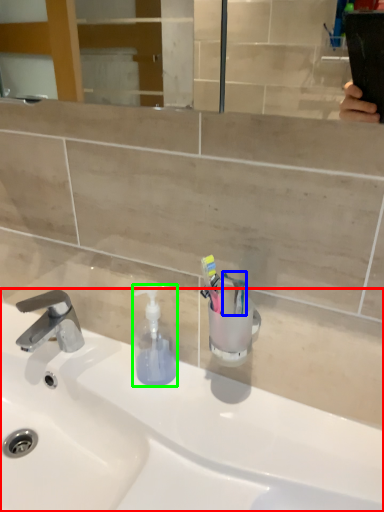
Question: Estimate the real-world distances between objects in this image. Which object is closer to sink (highlighted by a red box), toothbrush (highlighted by a blue box) or soap dispenser (highlighted by a green box)?

Choices:
 (A) toothbrush
 (B) soap dispenser

Answer: (B)